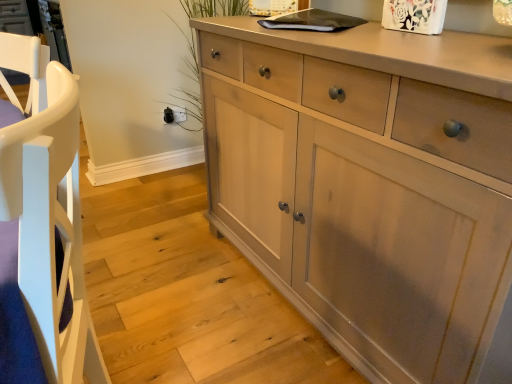
Question: From the image's perspective, would you say matte gray cabinet at lower left is shown under white wood armchair at left?

Choices:
 (A) yes
 (B) no

Answer: (B)

Question: Is matte gray cabinet at lower left aimed at white wood armchair at left?

Choices:
 (A) yes
 (B) no

Answer: (B)

Question: Is matte gray cabinet at lower left not within white wood armchair at left?

Choices:
 (A) yes
 (B) no

Answer: (A)

Question: Does matte gray cabinet at lower left have a lesser width compared to white wood armchair at left?

Choices:
 (A) no
 (B) yes

Answer: (A)

Question: Considering the relative positions of matte gray cabinet at lower left and white wood armchair at left in the image provided, is matte gray cabinet at lower left to the right of white wood armchair at left from the viewer's perspective?

Choices:
 (A) yes
 (B) no

Answer: (B)

Question: From the image's perspective, is matte gray cabinet at lower left located above or below white wood armchair at left?

Choices:
 (A) above
 (B) below

Answer: (A)

Question: Considering the positions of matte gray cabinet at lower left and white wood armchair at left in the image, is matte gray cabinet at lower left taller or shorter than white wood armchair at left?

Choices:
 (A) tall
 (B) short

Answer: (B)

Question: Visually, is matte gray cabinet at lower left positioned to the left or to the right of white wood armchair at left?

Choices:
 (A) left
 (B) right

Answer: (A)

Question: Does point (147, 321) appear closer or farther from the camera than point (3, 248)?

Choices:
 (A) closer
 (B) farther

Answer: (B)

Question: Considering the positions of point (68, 289) and point (157, 281), is point (68, 289) closer or farther from the camera than point (157, 281)?

Choices:
 (A) closer
 (B) farther

Answer: (A)

Question: From a real-world perspective, is white wood armchair at left positioned above or below matte gray cabinet at lower left?

Choices:
 (A) above
 (B) below

Answer: (A)

Question: Looking at their shapes, would you say white wood armchair at left is wider or thinner than matte gray cabinet at lower left?

Choices:
 (A) thin
 (B) wide

Answer: (A)

Question: Is white wood armchair at left inside or outside of matte gray cabinet at lower left?

Choices:
 (A) outside
 (B) inside

Answer: (A)

Question: Considering the positions of point (54, 84) and point (342, 296), is point (54, 84) closer or farther from the camera than point (342, 296)?

Choices:
 (A) closer
 (B) farther

Answer: (A)

Question: Looking at the image, does white wood armchair at left seem bigger or smaller compared to light wood cabinet at center?

Choices:
 (A) big
 (B) small

Answer: (B)